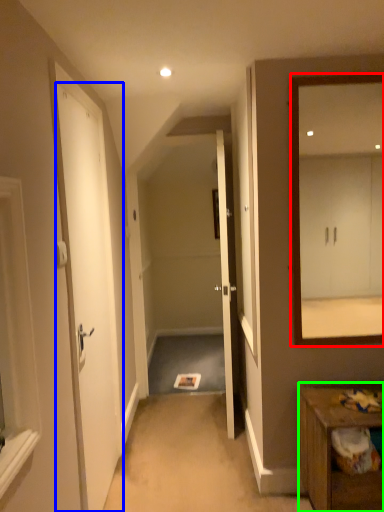
Question: Estimate the real-world distances between objects in this image. Which object is farther from mirror (highlighted by a red box), door (highlighted by a blue box) or table (highlighted by a green box)?

Choices:
 (A) door
 (B) table

Answer: (B)